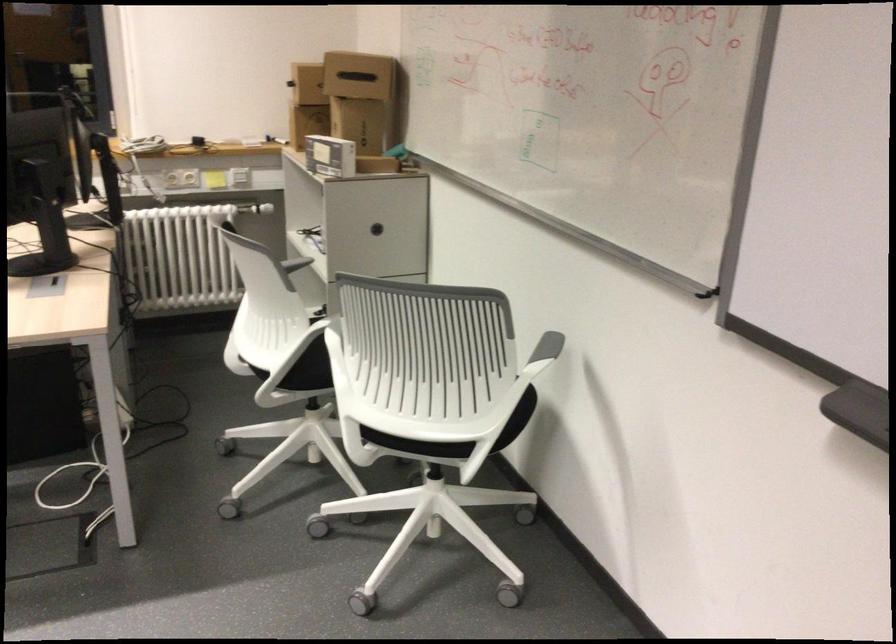
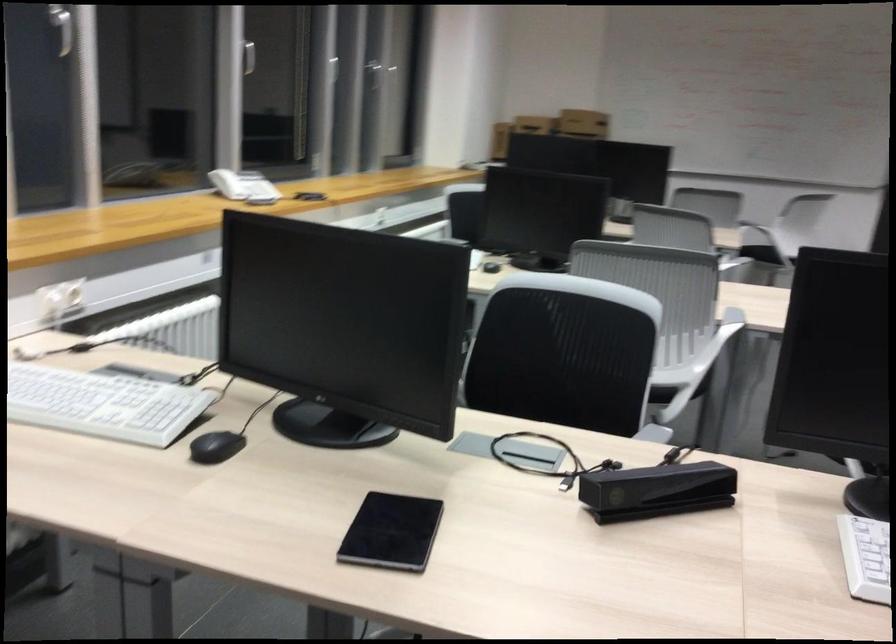
Question: I am providing you with two images of the same scene from different viewpoints. After the viewpoint changes to image2, which objects are now occluded?

Choices:
 (A) chair sitting surface
 (B) black binder clip
 (C) black tablet
 (D) black computer mouse

Answer: (A)